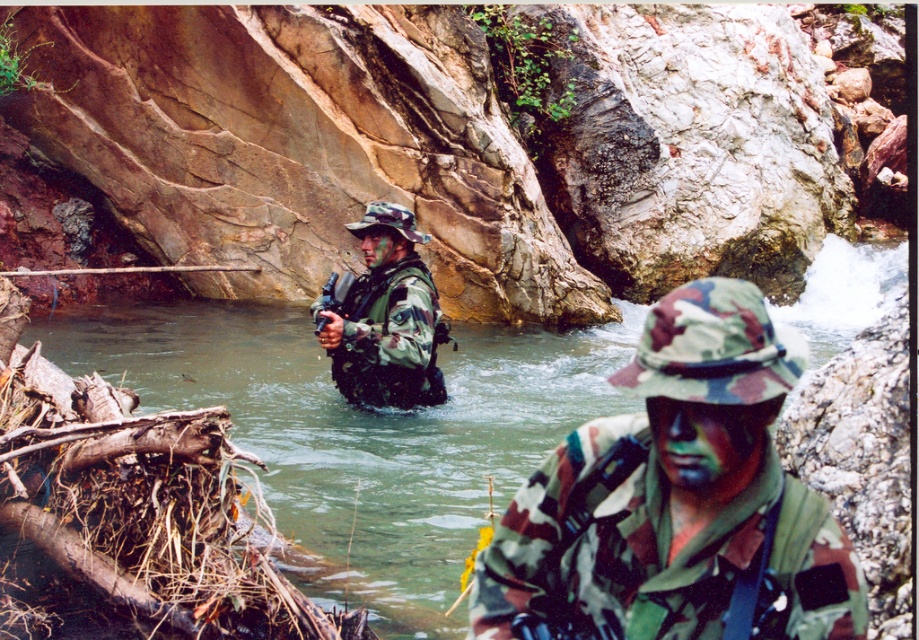
Question: Which point is closer to the camera?

Choices:
 (A) (418, 285)
 (B) (336, 314)
 (C) (486, 433)
 (D) (643, 449)

Answer: (D)

Question: Does camo fabric uniform at center appear under matte black rifle at center?

Choices:
 (A) no
 (B) yes

Answer: (B)

Question: Which point appears farthest from the camera in this image?

Choices:
 (A) coord(426,424)
 (B) coord(677,288)

Answer: (B)

Question: In this image, where is camo fabric uniform at center located relative to greenish water at creek center?

Choices:
 (A) above
 (B) below

Answer: (B)

Question: Which point is farther to the camera?

Choices:
 (A) greenish water at creek center
 (B) camouflage fabric helmet at center
 (C) matte black rifle at center
 (D) camo fabric uniform at center

Answer: (C)

Question: In this image, where is camo fabric uniform at center located relative to camouflage fabric helmet at center?

Choices:
 (A) left
 (B) right

Answer: (B)